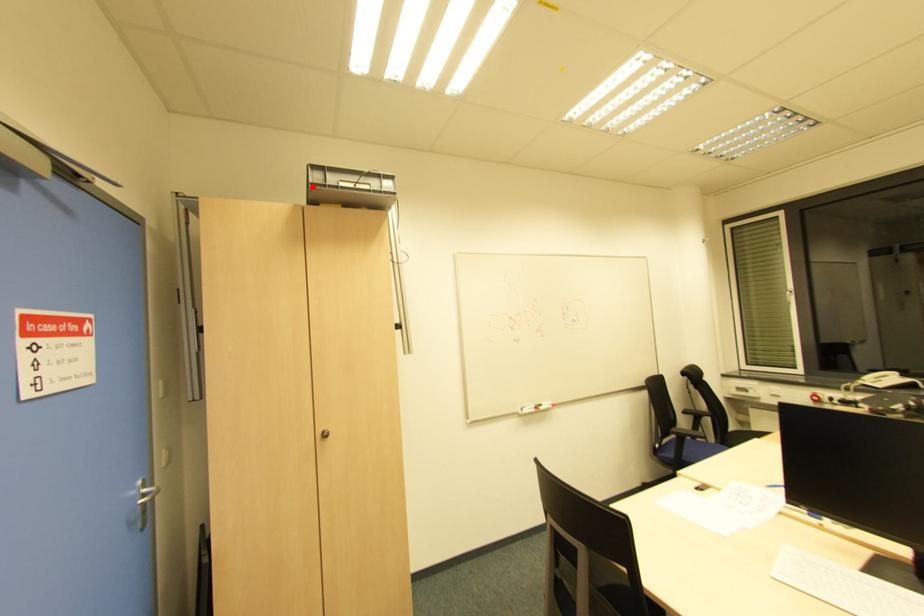
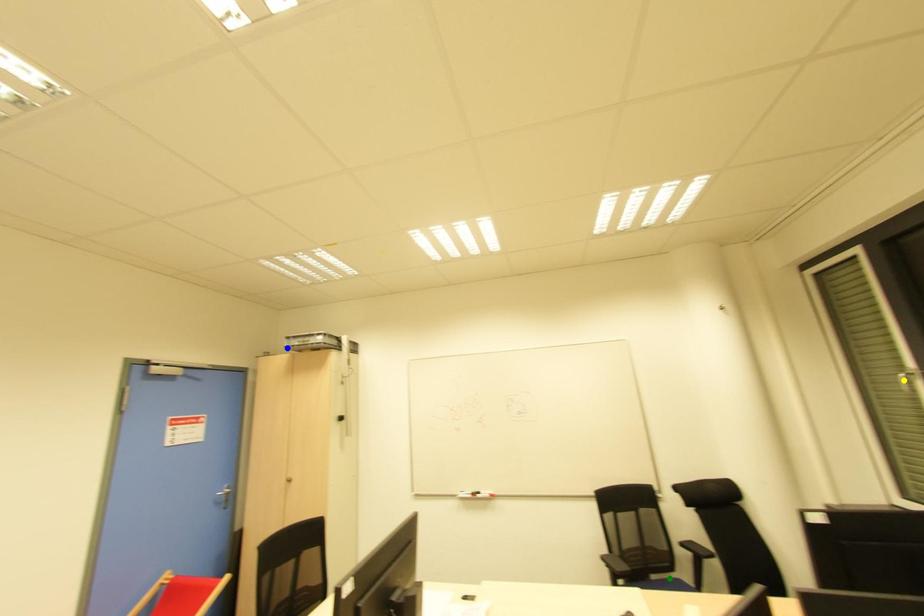
Question: I am providing you with two images of the same scene from different viewpoints. A red point is marked on the first image. You are given multiple points on the second image. In image 2, which mark is for the same physical point as the one in image 1?

Choices:
 (A) yellow point
 (B) green point
 (C) blue point

Answer: (C)